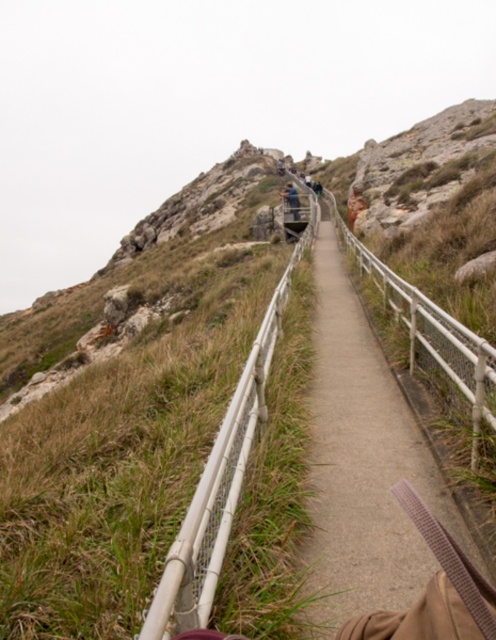
Question: Among these objects, which one is farthest from the camera?

Choices:
 (A) smooth concrete path at center
 (B) dark blue jeans at center

Answer: (B)

Question: Among these objects, which one is farthest from the camera?

Choices:
 (A) smooth concrete path at center
 (B) dark blue jeans at center

Answer: (B)

Question: Does smooth concrete path at center appear over dark blue jeans at center?

Choices:
 (A) no
 (B) yes

Answer: (A)

Question: Which point is farther to the camera?

Choices:
 (A) [x=311, y=448]
 (B) [x=298, y=202]

Answer: (B)

Question: Does smooth concrete path at center have a greater width compared to dark blue jeans at center?

Choices:
 (A) yes
 (B) no

Answer: (A)

Question: Can you confirm if smooth concrete path at center is smaller than dark blue jeans at center?

Choices:
 (A) yes
 (B) no

Answer: (A)